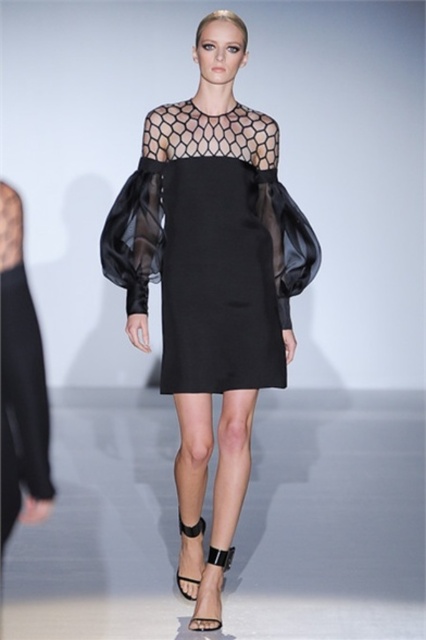
You are a photographer positioned at the front of the runway. You notice two points on the model wearing the black dress with geometric patterns. The first point is located at coordinates point [230,554] and the second at point [184,593]. Which of these points is closer to your camera lens?

Point [230,554] is closer to the camera lens because it is further to the viewer than point [184,593].

You are a photographer at a fashion show. You need to capture the model wearing the black sheer dress at center and the black leather sandal at center. However, the dress is partially covering the sandal. Can you adjust your angle to focus on the sandal without moving the model?

The black sheer dress at center is positioned over black leather sandal at center, so adjusting the angle might not fully reveal the sandal. Since the dress is covering the sandal, it may be challenging to focus on the sandal without moving the model.